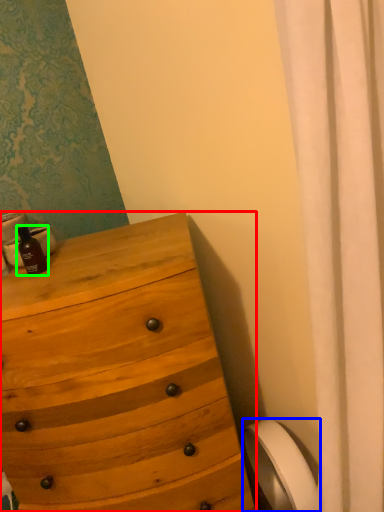
Question: Estimate the real-world distances between objects in this image. Which object is closer to chest of drawers (highlighted by a red box), toilet paper (highlighted by a blue box) or bottle (highlighted by a green box)?

Choices:
 (A) toilet paper
 (B) bottle

Answer: (B)